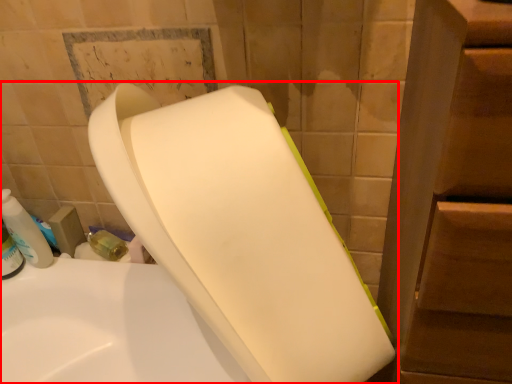
Question: Where is toilet (annotated by the red box) located in relation to cleaning product in the image?

Choices:
 (A) right
 (B) left

Answer: (A)